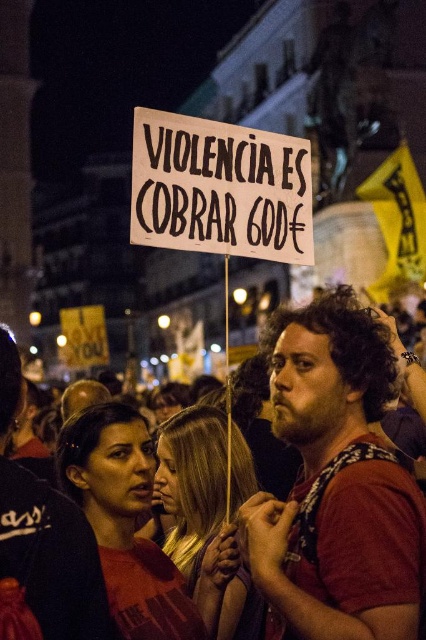
You are a photographer trying to capture the protest scene. You notice two points of interest in the image at coordinates point [253,508] and point [336,621]. Which point is closer to your camera?

Point [336,621] is closer to the camera because it is less further than point [253,508].